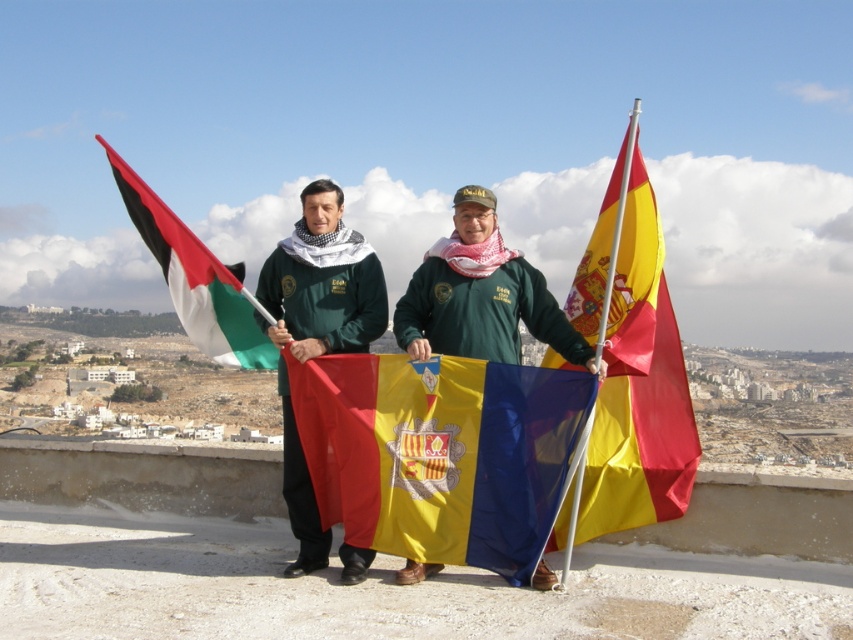
Is polyester flag at center above green matte jacket at center?

No.

Can you confirm if polyester flag at center is wider than green matte jacket at center?

Yes, polyester flag at center is wider than green matte jacket at center.

What do you see at coordinates (440, 452) in the screenshot? This screenshot has width=853, height=640. I see `polyester flag at center` at bounding box center [440, 452].

In order to click on polyester flag at center in this screenshot , I will do `click(440, 452)`.

Between yellow/red striped flag at right and green matte jacket at center, which one is positioned higher?

yellow/red striped flag at right is above.

Is yellow/red striped flag at right above green matte jacket at center?

Yes.

Which is behind, point (653, 323) or point (264, 260)?

The point (264, 260) is more distant.

Where is `yellow/red striped flag at right`? The height and width of the screenshot is (640, 853). yellow/red striped flag at right is located at coordinates pos(631,364).

Measure the distance between yellow/red striped flag at right and black and white striped flag at left.

yellow/red striped flag at right is 256.26 feet away from black and white striped flag at left.

In the scene shown: Who is more forward, (592,442) or (138,212)?

Point (592,442)

The width and height of the screenshot is (853, 640). Find the location of `yellow/red striped flag at right`. yellow/red striped flag at right is located at coordinates [631, 364].